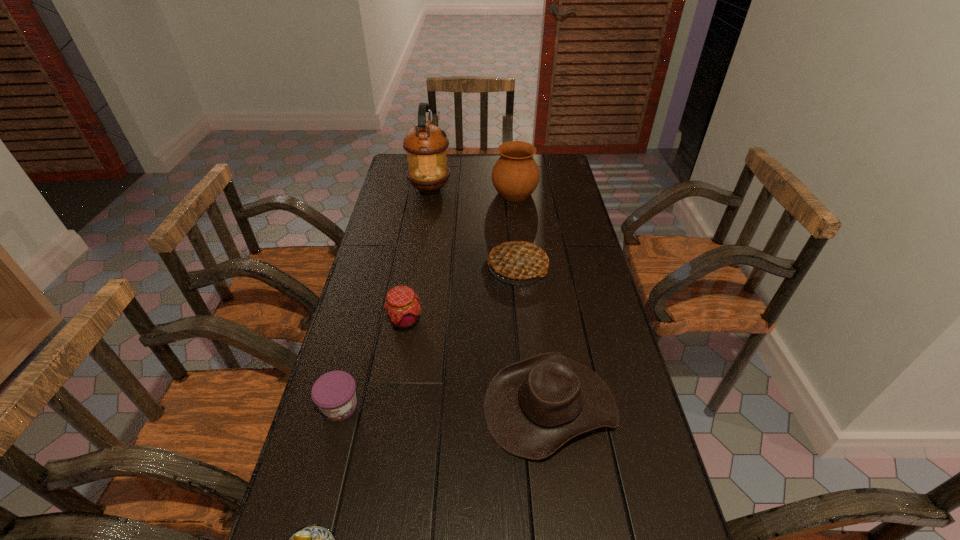
Locate an element on the screen. object located in the far left corner section of the desktop is located at coordinates (425, 144).

The image size is (960, 540). Identify the location of free space at the far edge of the desktop. (452, 180).

This screenshot has width=960, height=540. I want to click on free space at the left edge of the desktop, so click(x=368, y=342).

Find the location of a particular element. free region at the right edge is located at coordinates (595, 483).

Image resolution: width=960 pixels, height=540 pixels. What are the coordinates of `vacant space at the far right corner of the desktop` in the screenshot? It's located at (556, 166).

Locate an element on the screen. This screenshot has height=540, width=960. vacant point located between the nearer jam and the cowboy hat is located at coordinates pyautogui.click(x=445, y=406).

What are the coordinates of `vacant space that is in between the pottery and the cowboy hat` in the screenshot? It's located at (533, 300).

Identify the location of empty location between the fifth shortest object and the taller jam. (462, 294).

Identify the location of unoccupied position between the shorter jam and the tallest object. The width and height of the screenshot is (960, 540). (385, 298).

I want to click on free space that is in between the tallest object and the pie, so click(x=474, y=228).